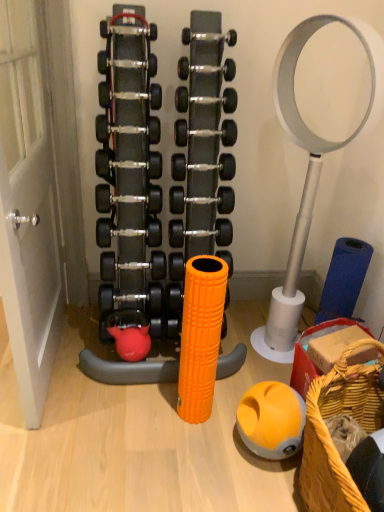
This screenshot has width=384, height=512. What are the coordinates of `silver metallic dumbbell at center, positioned as the sixth dumbbell in bottom-to-top order` in the screenshot? It's located at (127, 129).

Locate an element on the screen. The height and width of the screenshot is (512, 384). orange textured foam roller at center is located at coordinates (200, 336).

What do you see at coordinates (206, 100) in the screenshot? I see `silver metallic dumbbell at center, the second dumbbell when ordered from top to bottom` at bounding box center [206, 100].

Locate an element on the screen. Image resolution: width=384 pixels, height=512 pixels. silver metallic dumbbell at center, positioned as the sixth dumbbell in bottom-to-top order is located at coordinates (127, 129).

Between black rubber dumbbell at center, placed as the 5th dumbbell when sorted from top to bottom, and black rubber dumbbell at center, which ranks as the eighth dumbbell in top-to-bottom order, which one has more height?

Result: black rubber dumbbell at center, which ranks as the eighth dumbbell in top-to-bottom order, is taller.

From the image's perspective, which one is positioned lower, black rubber dumbbell at center, the fifth dumbbell positioned from the bottom, or black rubber dumbbell at center, the 2th dumbbell from the bottom?

black rubber dumbbell at center, the 2th dumbbell from the bottom, appears lower in the image.

In the scene shown: Considering their positions, is black rubber dumbbell at center, placed as the 5th dumbbell when sorted from top to bottom, located in front of or behind black rubber dumbbell at center, which ranks as the eighth dumbbell in top-to-bottom order?

black rubber dumbbell at center, placed as the 5th dumbbell when sorted from top to bottom, is positioned farther from the viewer than black rubber dumbbell at center, which ranks as the eighth dumbbell in top-to-bottom order.

Can you confirm if black rubber dumbbell at center, the fifth dumbbell positioned from the bottom, is bigger than black rubber dumbbell at center, the 2th dumbbell from the bottom?

No.

Can you tell me how much orange textured foam roller at center and silver metallic dumbbell at center, positioned as the fourth dumbbell in top-to-bottom order, differ in facing direction?

There is a 0.44-degree angle between the facing directions of orange textured foam roller at center and silver metallic dumbbell at center, positioned as the fourth dumbbell in top-to-bottom order.

From the image's perspective, is orange textured foam roller at center above or below silver metallic dumbbell at center, positioned as the fourth dumbbell in top-to-bottom order?

orange textured foam roller at center is below silver metallic dumbbell at center, positioned as the fourth dumbbell in top-to-bottom order.

Considering the points (184, 362) and (150, 125), which point is behind, point (184, 362) or point (150, 125)?

The point (150, 125) is farther.

From a real-world perspective, is orange textured foam roller at center on silver metallic dumbbell at center, positioned as the sixth dumbbell in bottom-to-top order?

Incorrect, from a real-world perspective, orange textured foam roller at center is lower than silver metallic dumbbell at center, positioned as the sixth dumbbell in bottom-to-top order.

Is black rubber dumbbell at center, the 1th dumbbell when ordered from bottom to top, directly adjacent to black rubber dumbbell at center, the 2th dumbbell from the bottom?

No.

From the image's perspective, is black rubber dumbbell at center, the ninth dumbbell positioned from the top, on black rubber dumbbell at center, which ranks as the eighth dumbbell in top-to-bottom order?

No.

Where is `dumbbell below the black rubber dumbbell at center, which ranks as the eighth dumbbell in top-to-bottom order (from a real-world perspective)`? dumbbell below the black rubber dumbbell at center, which ranks as the eighth dumbbell in top-to-bottom order (from a real-world perspective) is located at coordinates point(128,232).

Is black rubber dumbbell at center, the 2th dumbbell from the bottom, located within black rubber dumbbell at center, the 1th dumbbell when ordered from bottom to top?

No, black rubber dumbbell at center, the 1th dumbbell when ordered from bottom to top, does not contain black rubber dumbbell at center, the 2th dumbbell from the bottom.

Which object is further away from the camera, silver metallic dumbbell at center, the 9th dumbbell when ordered from bottom to top, or orange rubber ball at lower center?

Positioned behind is silver metallic dumbbell at center, the 9th dumbbell when ordered from bottom to top.

From a real-world perspective, is silver metallic dumbbell at center, the 9th dumbbell when ordered from bottom to top, positioned above or below orange rubber ball at lower center?

In terms of real-world spatial position, silver metallic dumbbell at center, the 9th dumbbell when ordered from bottom to top, is above orange rubber ball at lower center.

Is silver metallic dumbbell at center, the 9th dumbbell when ordered from bottom to top, to the right of orange rubber ball at lower center from the viewer's perspective?

No.

I want to click on ball in front of the silver metallic dumbbell at center, the first dumbbell positioned from the top, so click(x=271, y=420).

Can you tell me how much black rubber dumbbell at center, which appears as the third dumbbell when viewed from the top, and black rubber dumbbell at center, which ranks as the seventh dumbbell in top-to-bottom order, differ in facing direction?

black rubber dumbbell at center, which appears as the third dumbbell when viewed from the top, and black rubber dumbbell at center, which ranks as the seventh dumbbell in top-to-bottom order, are facing 3.38e-05 degrees away from each other.

Can you confirm if black rubber dumbbell at center, positioned as the seventh dumbbell in bottom-to-top order, is bigger than black rubber dumbbell at center, arranged as the 3th dumbbell when ordered from the bottom?

Incorrect, black rubber dumbbell at center, positioned as the seventh dumbbell in bottom-to-top order, is not larger than black rubber dumbbell at center, arranged as the 3th dumbbell when ordered from the bottom.

Is point (232, 139) closer to camera compared to point (180, 189)?

Yes, point (232, 139) is in front of point (180, 189).

Is black rubber dumbbell at center, which appears as the third dumbbell when viewed from the top, oriented away from black rubber dumbbell at center, arranged as the 3th dumbbell when ordered from the bottom?

No, black rubber dumbbell at center, which appears as the third dumbbell when viewed from the top, is not facing the opposite direction of black rubber dumbbell at center, arranged as the 3th dumbbell when ordered from the bottom.

Find the location of a particular element. The image size is (384, 512). the 1st dumbbell directly above the silver metallic dumbbell at center, positioned as the sixth dumbbell in bottom-to-top order (from a real-world perspective) is located at coordinates (206, 100).

From a real-world perspective, is silver metallic dumbbell at center, which ranks as the 8th dumbbell in bottom-to-top order, located higher than silver metallic dumbbell at center, positioned as the fourth dumbbell in top-to-bottom order?

Yes, from a real-world perspective, silver metallic dumbbell at center, which ranks as the 8th dumbbell in bottom-to-top order, is above silver metallic dumbbell at center, positioned as the fourth dumbbell in top-to-bottom order.

Can you confirm if silver metallic dumbbell at center, the second dumbbell when ordered from top to bottom, is shorter than silver metallic dumbbell at center, positioned as the fourth dumbbell in top-to-bottom order?

Indeed, silver metallic dumbbell at center, the second dumbbell when ordered from top to bottom, has a lesser height compared to silver metallic dumbbell at center, positioned as the fourth dumbbell in top-to-bottom order.

Is silver metallic dumbbell at center, which ranks as the 8th dumbbell in bottom-to-top order, not close to silver metallic dumbbell at center, positioned as the sixth dumbbell in bottom-to-top order?

silver metallic dumbbell at center, which ranks as the 8th dumbbell in bottom-to-top order, is near silver metallic dumbbell at center, positioned as the sixth dumbbell in bottom-to-top order, not far away.

How many degrees apart are the facing directions of woven straw basket at lower right and white matte door at left?

0.0227 degrees.

In the image, is woven straw basket at lower right positioned in front of or behind white matte door at left?

In the image, woven straw basket at lower right appears behind white matte door at left.

Are woven straw basket at lower right and white matte door at left beside each other?

No, woven straw basket at lower right is not beside white matte door at left.

Considering the relative positions of woven straw basket at lower right and white matte door at left in the image provided, is woven straw basket at lower right to the left of white matte door at left from the viewer's perspective?

Incorrect, woven straw basket at lower right is not on the left side of white matte door at left.

Identify the location of the 4th dumbbell counting from the left side of the black rubber dumbbell at center, placed as the 5th dumbbell when sorted from top to bottom. Image resolution: width=384 pixels, height=512 pixels. (128, 199).

What are the coordinates of `toy directly beneath the silver metallic dumbbell at center, positioned as the fourth dumbbell in top-to-bottom order (from a real-world perspective)` in the screenshot? It's located at (200, 336).

Looking at the image, which one is located further to black rubber dumbbell at center, the 6th dumbbell viewed from the top, orange textured foam roller at center or orange rubber ball at lower center?

orange rubber ball at lower center.

When comparing their distances from black rubber dumbbell at center, positioned as the seventh dumbbell in bottom-to-top order, does silver metallic dumbbell at center, positioned as the fourth dumbbell in top-to-bottom order, or white matte door at left seem further?

Based on the image, white matte door at left appears to be further to black rubber dumbbell at center, positioned as the seventh dumbbell in bottom-to-top order.

Based on their spatial positions, is orange rubber ball at lower center or black rubber dumbbell at center, the 6th dumbbell viewed from the top, closer to silver metallic dumbbell at center, positioned as the sixth dumbbell in bottom-to-top order?

The object closer to silver metallic dumbbell at center, positioned as the sixth dumbbell in bottom-to-top order, is black rubber dumbbell at center, the 6th dumbbell viewed from the top.

Based on their spatial positions, is silver metallic dumbbell at center, which ranks as the 8th dumbbell in bottom-to-top order, or orange rubber ball at lower center further from black rubber dumbbell at center, which appears as the third dumbbell when viewed from the top?

orange rubber ball at lower center lies further to black rubber dumbbell at center, which appears as the third dumbbell when viewed from the top, than the other object.

Based on their spatial positions, is silver metallic dumbbell at center, which ranks as the 8th dumbbell in bottom-to-top order, or white matte door at left closer to black rubber dumbbell at center, positioned as the seventh dumbbell in bottom-to-top order?

silver metallic dumbbell at center, which ranks as the 8th dumbbell in bottom-to-top order, lies closer to black rubber dumbbell at center, positioned as the seventh dumbbell in bottom-to-top order, than the other object.

Estimate the real-world distances between objects in this image. Which object is further from black rubber dumbbell at center, which appears as the third dumbbell when viewed from the top, black rubber dumbbell at center, placed as the 5th dumbbell when sorted from top to bottom, or black rubber dumbbell at center, the 2th dumbbell from the bottom?

Among the two, black rubber dumbbell at center, the 2th dumbbell from the bottom, is located further to black rubber dumbbell at center, which appears as the third dumbbell when viewed from the top.

Based on their spatial positions, is black rubber dumbbell at center, the 2th dumbbell from the bottom, or orange textured foam roller at center closer to woven straw basket at lower right?

orange textured foam roller at center is closer to woven straw basket at lower right.

From the image, which object appears to be farther from silver metallic dumbbell at center, the first dumbbell positioned from the top, black rubber dumbbell at center, the ninth dumbbell positioned from the top, or black rubber dumbbell at center, which is counted as the fourth dumbbell, starting from the bottom?

Based on the image, black rubber dumbbell at center, the ninth dumbbell positioned from the top, appears to be further to silver metallic dumbbell at center, the first dumbbell positioned from the top.

Find the location of a particular element. toy situated between white matte door at left and orange rubber ball at lower center from left to right is located at coordinates (200, 336).

Locate an element on the screen. This screenshot has height=512, width=384. ball between black rubber dumbbell at center, the fifth dumbbell positioned from the bottom, and woven straw basket at lower right in the up-down direction is located at coordinates (271, 420).

Where is `toy between black rubber dumbbell at center, arranged as the 3th dumbbell when ordered from the bottom, and orange rubber ball at lower center from top to bottom`? Image resolution: width=384 pixels, height=512 pixels. toy between black rubber dumbbell at center, arranged as the 3th dumbbell when ordered from the bottom, and orange rubber ball at lower center from top to bottom is located at coordinates (200, 336).

This screenshot has width=384, height=512. Find the location of `toy between white matte door at left and woven straw basket at lower right`. toy between white matte door at left and woven straw basket at lower right is located at coordinates (200, 336).